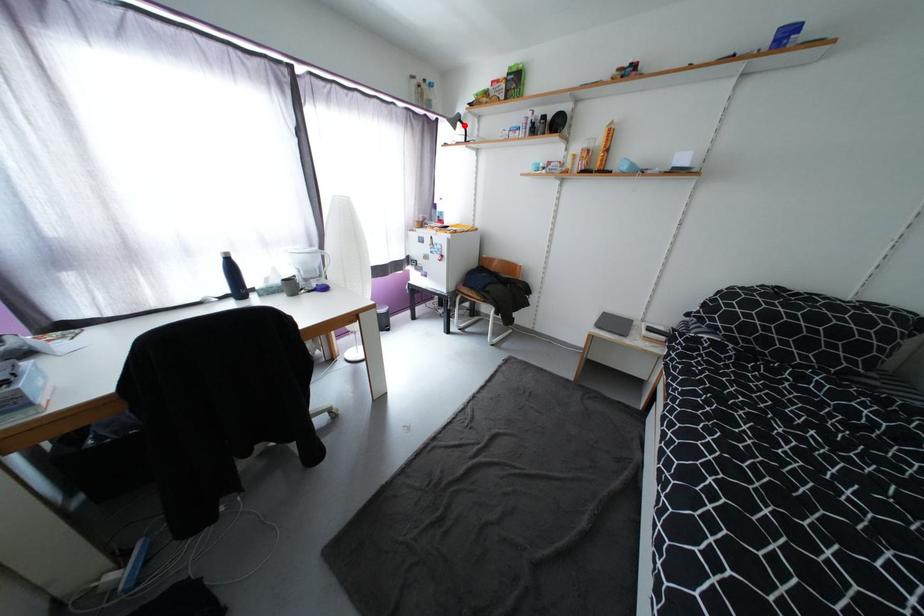
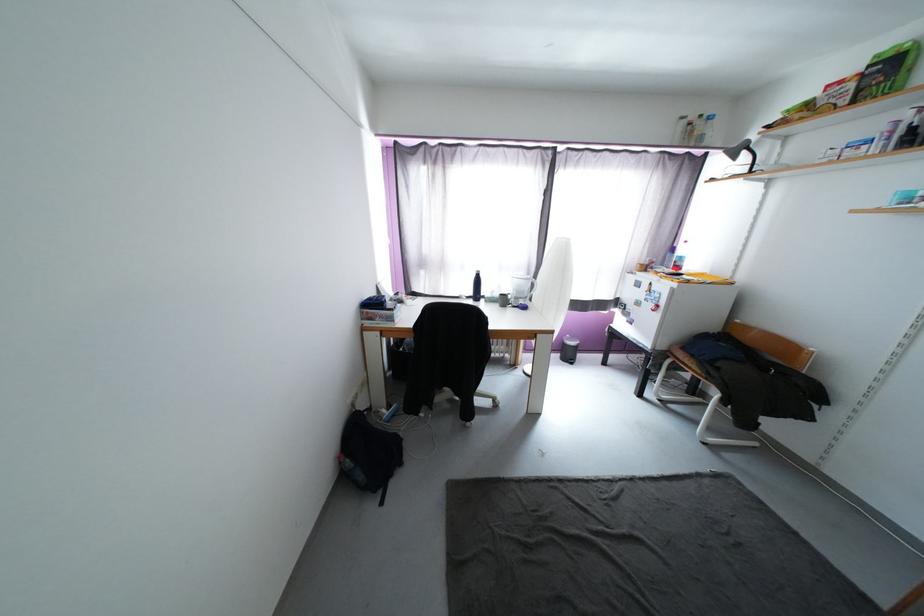
Question: I am providing you with two images of the same scene from different viewpoints. A red point is shown in image1. For the corresponding object point in image2, is it positioned nearer or farther from the camera?

Choices:
 (A) Nearer
 (B) Farther

Answer: (B)